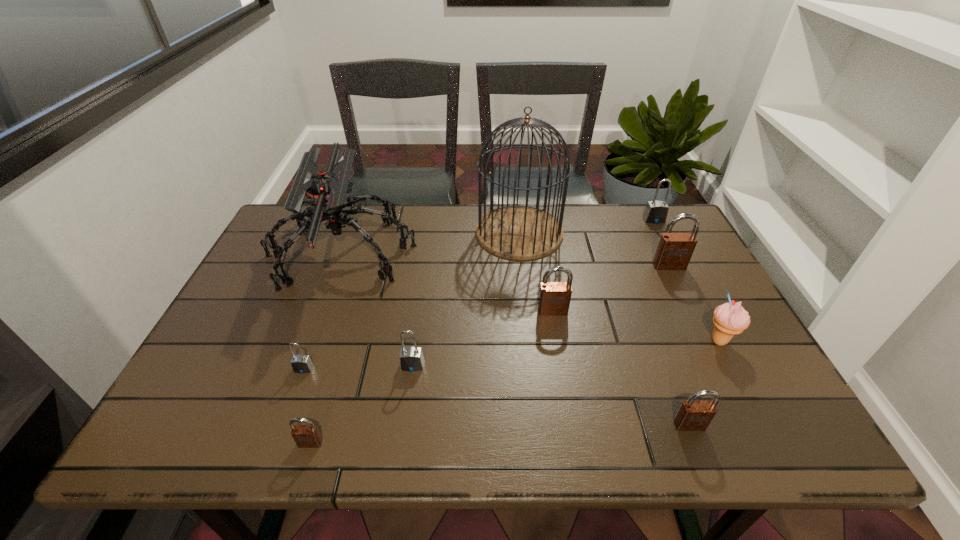
You are a GUI agent. You are given a task and a screenshot of the screen. Output one action in this format:
    pyautogui.click(x=<x>, y=<y>)
    Task: Click on the free space that satisfies the following two spatial constraints: 1. at the door of the tallest object; 2. on the shackle of the fifth padlock from right to left
    The image size is (960, 540).
    Given the screenshot: What is the action you would take?
    pyautogui.click(x=534, y=366)